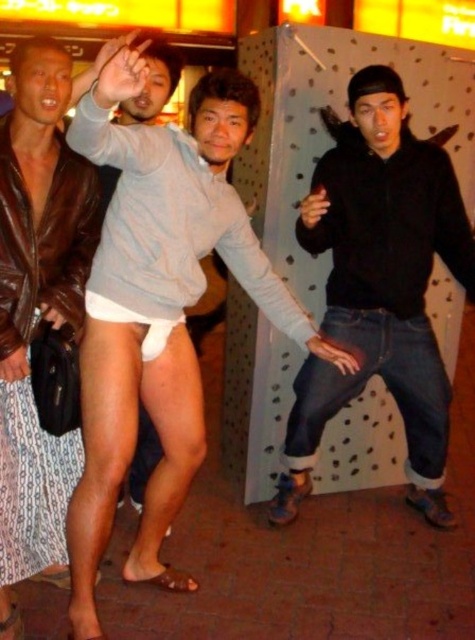
Question: Which point is farther to the camera?

Choices:
 (A) brown leather jacket at left
 (B) white fabric underwear at center
 (C) black matte hoodie at center

Answer: (C)

Question: Can you confirm if white matte underwear at center is thinner than black matte hoodie at center?

Choices:
 (A) yes
 (B) no

Answer: (B)

Question: From the image, what is the correct spatial relationship of white matte underwear at center in relation to black matte hoodie at center?

Choices:
 (A) above
 (B) below

Answer: (B)

Question: Considering the real-world distances, which object is closest to the black matte hoodie at center?

Choices:
 (A) white matte underwear at center
 (B) white fabric underwear at center
 (C) brown leather jacket at left

Answer: (A)

Question: Which of these objects is positioned closest to the black matte hoodie at center?

Choices:
 (A) white fabric underwear at center
 (B) brown leather jacket at left

Answer: (A)

Question: Does brown leather jacket at left appear over white fabric underwear at center?

Choices:
 (A) yes
 (B) no

Answer: (B)